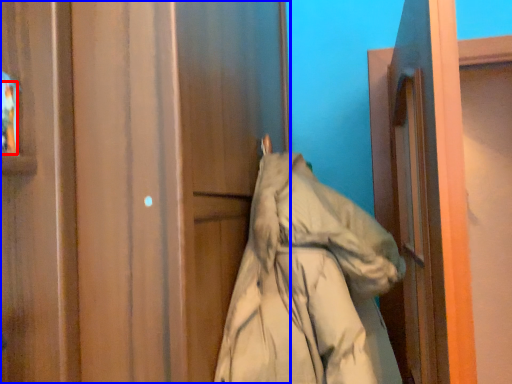
Question: Among these objects, which one is nearest to the camera, person (highlighted by a red box) or door (highlighted by a blue box)?

Choices:
 (A) person
 (B) door

Answer: (B)